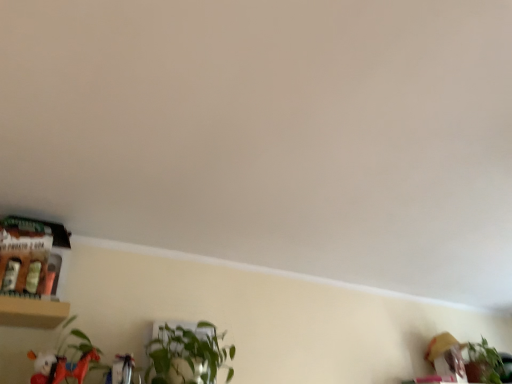
Question: Is green leafy plant at center, which is counted as the second houseplant, starting from the back, completely or partially outside of matte white plush at lower left?

Choices:
 (A) yes
 (B) no

Answer: (A)

Question: Does green leafy plant at center, the 1th houseplant viewed from the top, have a lesser width compared to matte white plush at lower left?

Choices:
 (A) no
 (B) yes

Answer: (A)

Question: Is green leafy plant at center, positioned as the first houseplant in front-to-back order, smaller than matte white plush at lower left?

Choices:
 (A) yes
 (B) no

Answer: (B)

Question: Is matte white plush at lower left a part of green leafy plant at center, which is the 2th houseplant in right-to-left order?

Choices:
 (A) yes
 (B) no

Answer: (B)

Question: Considering the relative positions of green leafy plant at center, which is the 2th houseplant in right-to-left order, and matte white plush at lower left in the image provided, is green leafy plant at center, which is the 2th houseplant in right-to-left order, to the left of matte white plush at lower left from the viewer's perspective?

Choices:
 (A) no
 (B) yes

Answer: (A)

Question: Does point (498, 354) appear closer or farther from the camera than point (52, 362)?

Choices:
 (A) closer
 (B) farther

Answer: (B)

Question: From the image's perspective, is green leafy plant at lower right, placed as the 1th houseplant when sorted from bottom to top, above or below matte white plush at lower left?

Choices:
 (A) above
 (B) below

Answer: (B)

Question: Relative to matte white plush at lower left, is green leafy plant at lower right, which appears as the first houseplant when viewed from the back, in front or behind?

Choices:
 (A) front
 (B) behind

Answer: (B)

Question: Is green leafy plant at lower right, which is counted as the first houseplant, starting from the right, spatially inside matte white plush at lower left, or outside of it?

Choices:
 (A) outside
 (B) inside

Answer: (A)

Question: Considering the positions of point (159, 334) and point (480, 354), is point (159, 334) closer or farther from the camera than point (480, 354)?

Choices:
 (A) closer
 (B) farther

Answer: (A)

Question: Considering their positions, is green leafy plant at center, the 1th houseplant viewed from the top, located in front of or behind green leafy plant at lower right, placed as the 2th houseplant when sorted from top to bottom?

Choices:
 (A) behind
 (B) front

Answer: (B)

Question: In terms of width, does green leafy plant at center, the 2th houseplant in the bottom-to-top sequence, look wider or thinner when compared to green leafy plant at lower right, which ranks as the 2th houseplant in front-to-back order?

Choices:
 (A) wide
 (B) thin

Answer: (B)

Question: In the image, is green leafy plant at center, the 2th houseplant in the bottom-to-top sequence, on the left side or the right side of green leafy plant at lower right, placed as the 1th houseplant when sorted from bottom to top?

Choices:
 (A) right
 (B) left

Answer: (B)

Question: Is matte white plush at lower left spatially inside green leafy plant at center, positioned as the first houseplant in front-to-back order, or outside of it?

Choices:
 (A) outside
 (B) inside

Answer: (A)

Question: Is matte white plush at lower left taller or shorter than green leafy plant at center, the 2th houseplant in the bottom-to-top sequence?

Choices:
 (A) short
 (B) tall

Answer: (A)